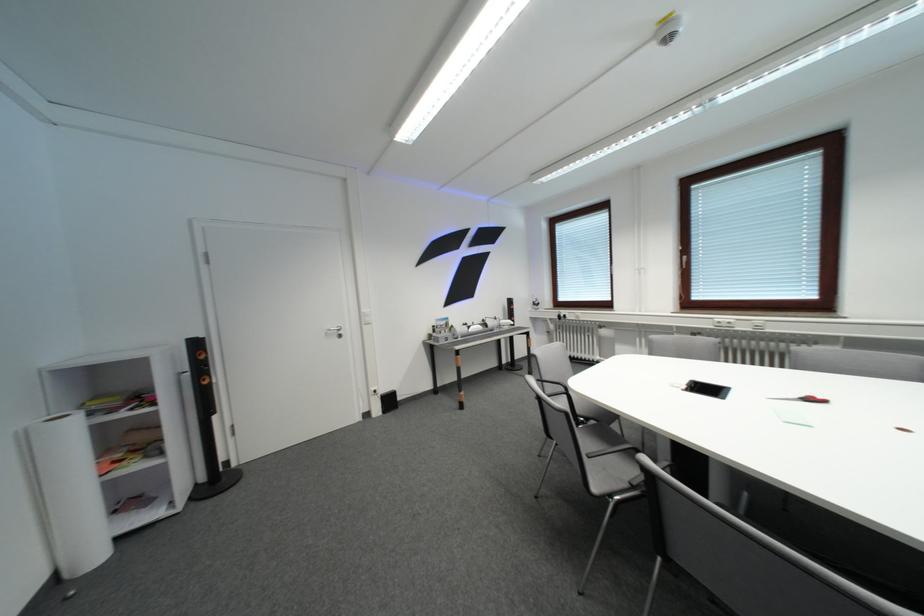
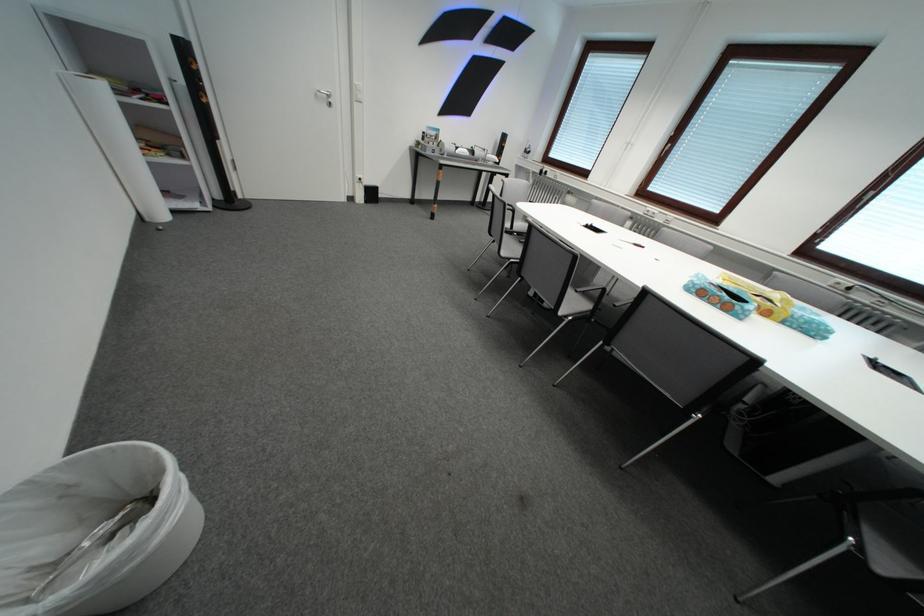
Question: I am providing you with two images of the same scene from different viewpoints. Please identify which objects are invisible in image2.

Choices:
 (A) grey chair sitting surface
 (B) black floor speaker
 (C) black smartphone
 (D) closed white laptop

Answer: (C)